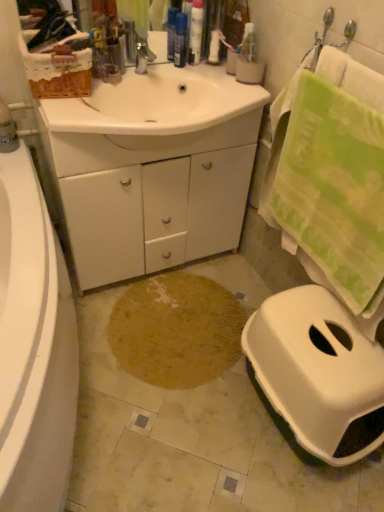
The image size is (384, 512). I want to click on free space in front of white plastic bottle at upper center, marked as the first toiletry in a right-to-left arrangement, so tap(183, 91).